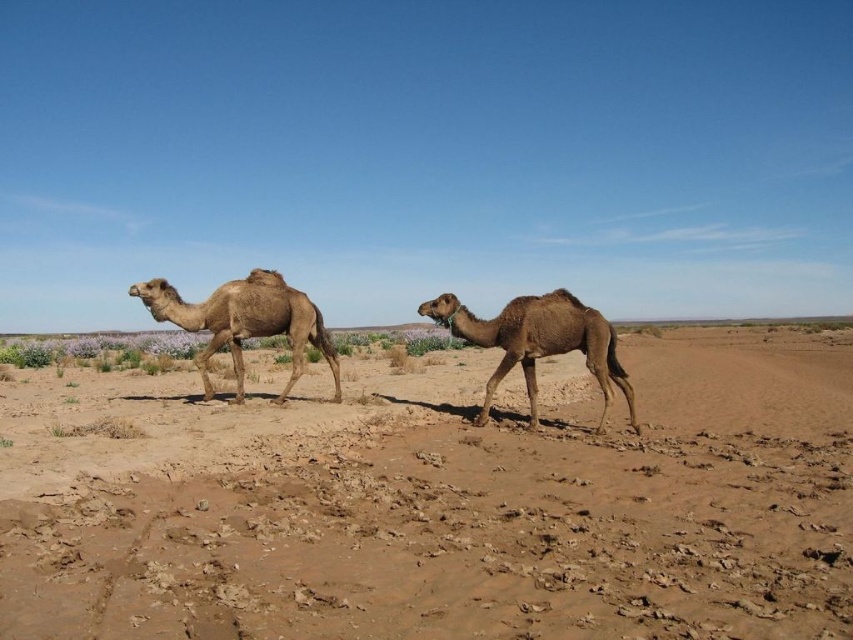
In the scene shown: You are a traveler in the desert and need to cross a narrow path that is 3 meters wide. You see the brown matte camel at center and the desert tan camel at left. Can both camels walk side by side through the path without overlapping?

The distance between the brown matte camel at center and desert tan camel at left is 2.94 meters, so they can walk side by side through the 3 meters wide path without overlapping.

You are a desert explorer trying to cross the desert. You see the brown sandy dirt at center and the desert tan camel at left. Which path is wider for you to walk through?

The brown sandy dirt at center is wider than the desert tan camel at left, so you should choose the path through the brown sandy dirt at center.

You are standing in the desert scene and want to place a small flag exactly at the point marked by the coordinates point (x=489, y=522). According to the scene description, what type of terrain will the flag be placed on?

The point (x=489, y=522) corresponds to brown sandy dirt at center, so the flag will be placed on brown sandy dirt at center.